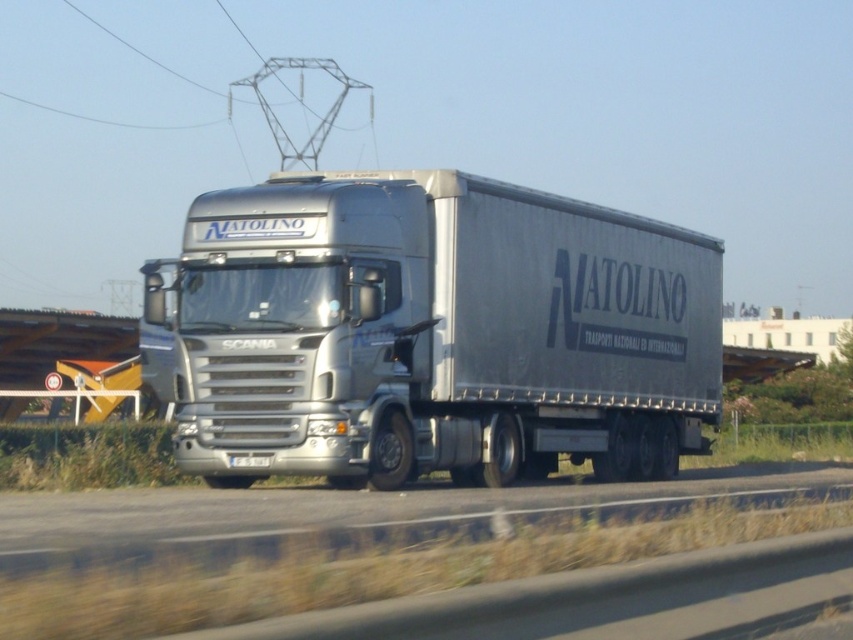
Question: Which point appears farthest from the camera in this image?

Choices:
 (A) (308, 445)
 (B) (849, 483)

Answer: (B)

Question: Does silver metallic trailer truck at center have a greater width compared to gray asphalt road at center?

Choices:
 (A) no
 (B) yes

Answer: (A)

Question: Which point is closer to the camera?

Choices:
 (A) (569, 442)
 (B) (795, 493)

Answer: (B)

Question: Does silver metallic trailer truck at center have a greater width compared to gray asphalt road at center?

Choices:
 (A) no
 (B) yes

Answer: (A)

Question: Which point appears closest to the camera in this image?

Choices:
 (A) (273, 182)
 (B) (78, 540)

Answer: (B)

Question: Can you confirm if silver metallic trailer truck at center is smaller than gray asphalt road at center?

Choices:
 (A) no
 (B) yes

Answer: (B)